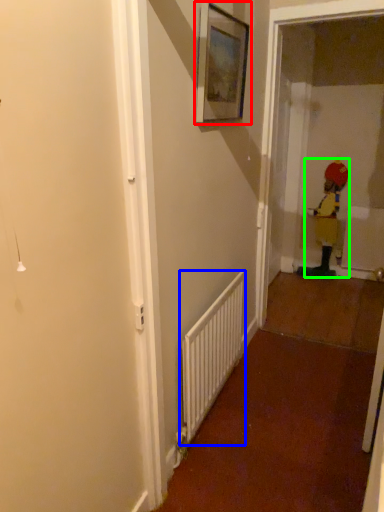
Question: Which object is positioned farthest from picture frame (highlighted by a red box)? Select from radiator (highlighted by a blue box) and toddler (highlighted by a green box).

Choices:
 (A) radiator
 (B) toddler

Answer: (B)